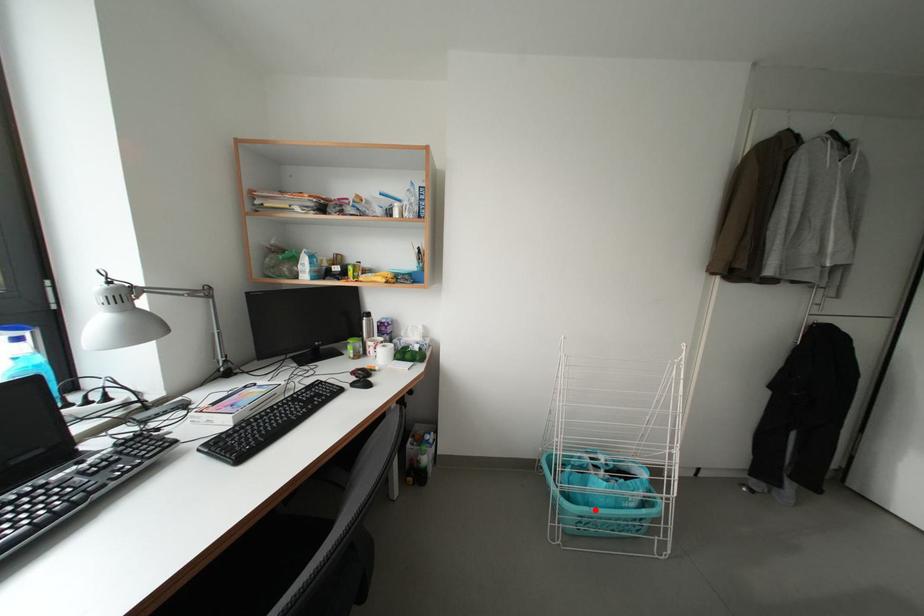
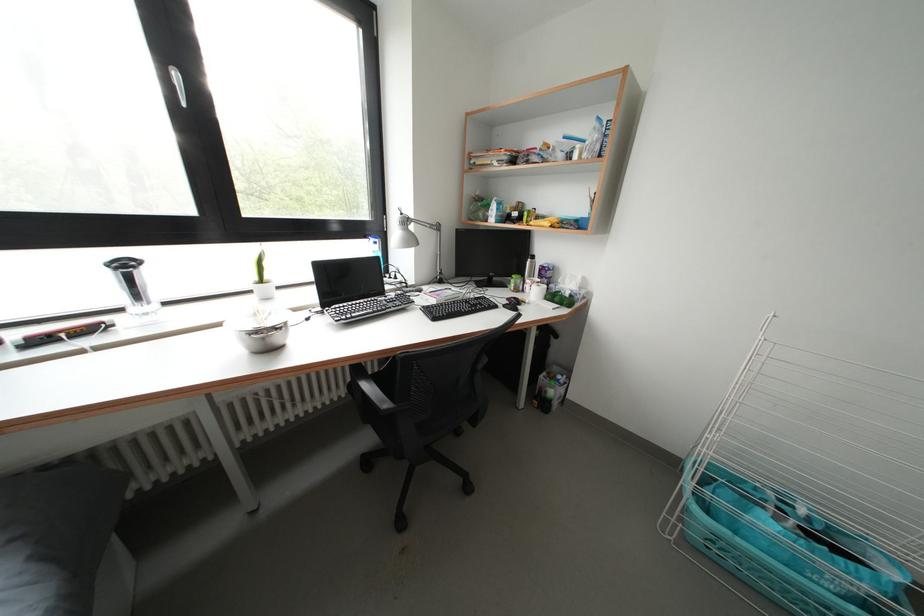
Find the pixel in the second image that matches the highlighted location in the first image.

(743, 537)